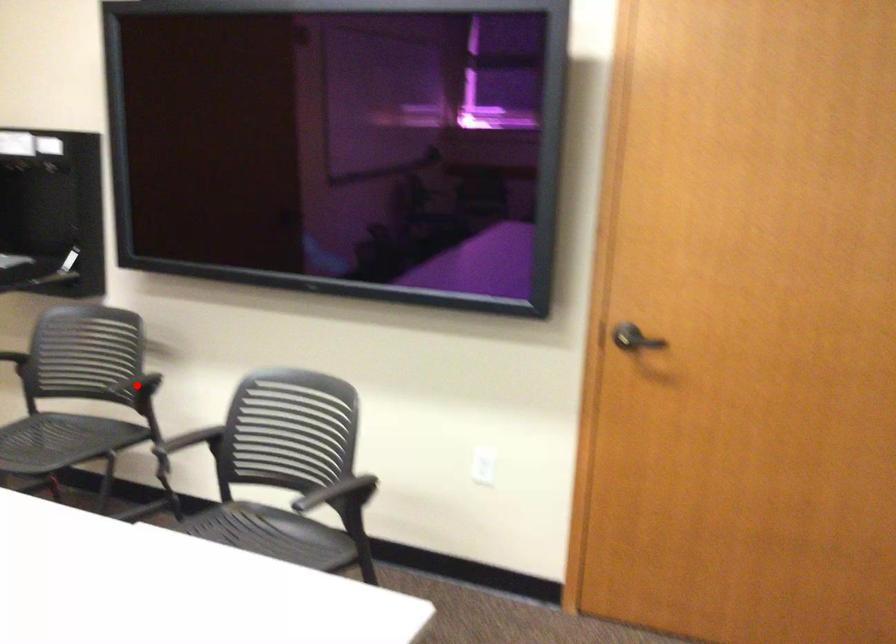
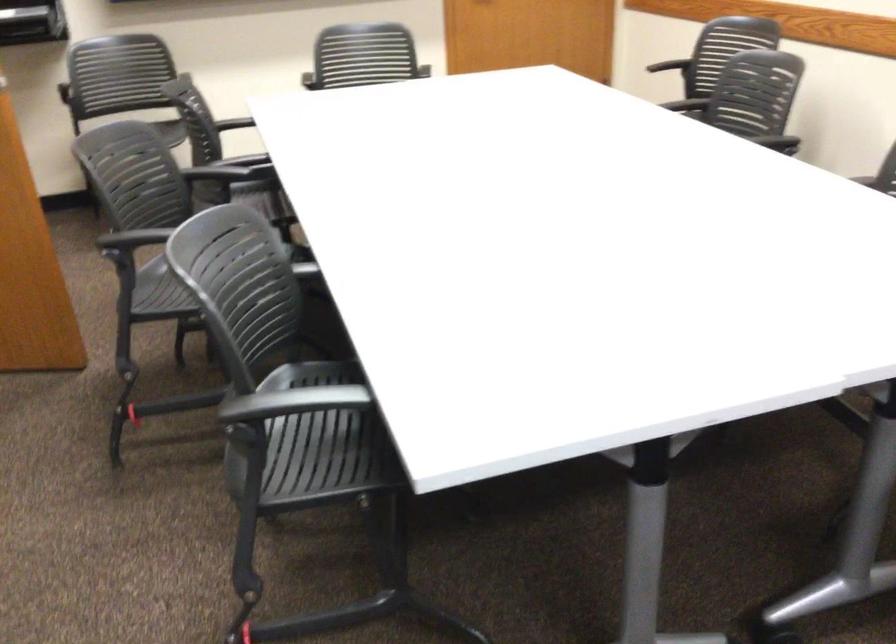
Question: I am providing you with two images of the same scene from different viewpoints. A red point is marked on the first image. Can you still see the location of the red point in image 2?

Choices:
 (A) Yes
 (B) No

Answer: (B)